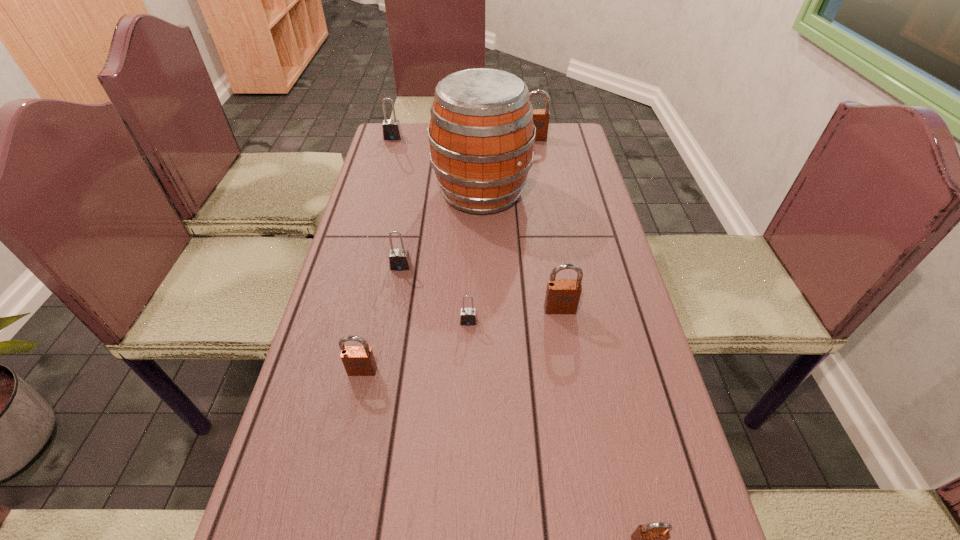
Locate an element on the screen. the seventh farthest object is located at coordinates (358, 361).

Locate an element on the screen. This screenshot has width=960, height=540. the second nearest brown padlock is located at coordinates (358, 361).

Where is `the fourth padlock from left to right`? This screenshot has height=540, width=960. the fourth padlock from left to right is located at coordinates (468, 317).

This screenshot has width=960, height=540. Identify the location of the third nearest padlock. (468, 317).

Find the location of a particular element. The height and width of the screenshot is (540, 960). vacant space located 0.400m on the front of the cider is located at coordinates (482, 335).

Where is `free spot located 0.260m on the front-facing side of the farthest brown padlock`? The image size is (960, 540). free spot located 0.260m on the front-facing side of the farthest brown padlock is located at coordinates (541, 182).

Locate an element on the screen. The height and width of the screenshot is (540, 960). vacant region located 0.300m on the shackle of the biggest gray padlock is located at coordinates (379, 188).

Where is `vacant space located 0.060m on the front-facing side of the second biggest brown padlock`? Image resolution: width=960 pixels, height=540 pixels. vacant space located 0.060m on the front-facing side of the second biggest brown padlock is located at coordinates (564, 335).

Image resolution: width=960 pixels, height=540 pixels. I want to click on vacant space located 0.050m on the shackle of the fifth nearest object, so click(397, 285).

Where is `free space located 0.150m on the front-facing side of the seventh farthest object`? The width and height of the screenshot is (960, 540). free space located 0.150m on the front-facing side of the seventh farthest object is located at coordinates (347, 447).